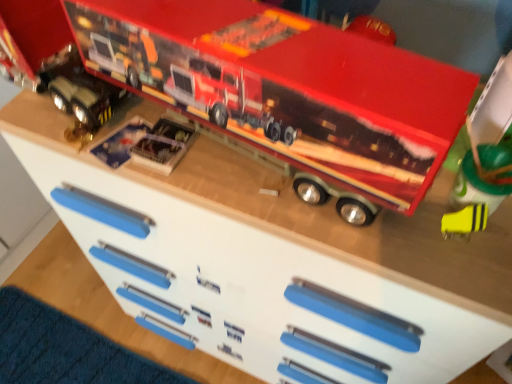
Locate an element on the screen. This screenshot has height=384, width=512. vacant space positioned to the left of clear plastic toy at center, marked as the second toy in a left-to-right arrangement is located at coordinates (74, 135).